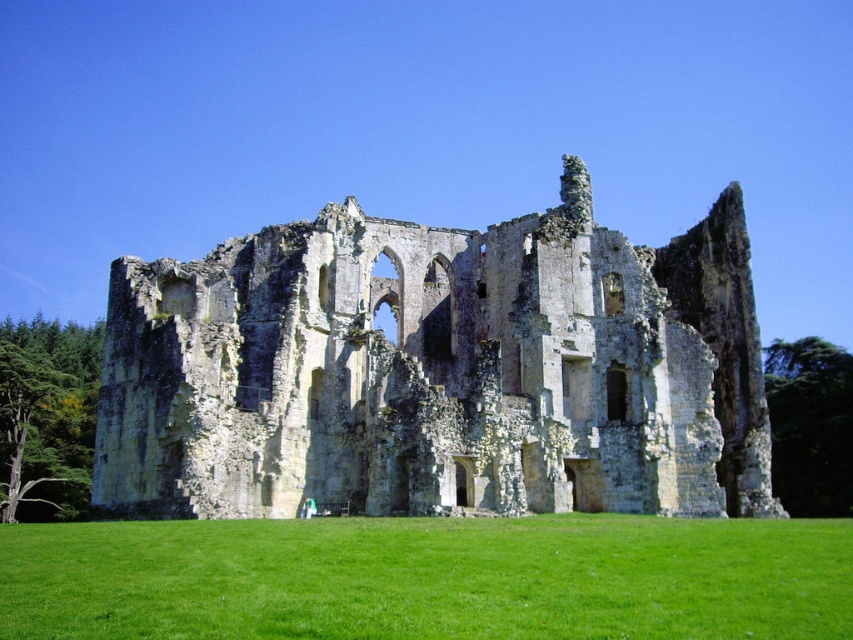
Consider the image. You are standing in front of the ruins of an old stone structure. You notice two points marked on the facade. The first point is at coordinates point (592, 260) and the second is at point (444, 595). If you were to walk towards the structure, which point would you encounter first?

Point (592, 260) is further to the viewer than point (444, 595), so you would encounter point (592, 260) first as you approach the structure.

You are an archaeologist standing at the entrance of the ruins. You notice two yellow stone ruins at center. How far apart are they?

The yellow stone ruins at center are 197.41 feet apart.